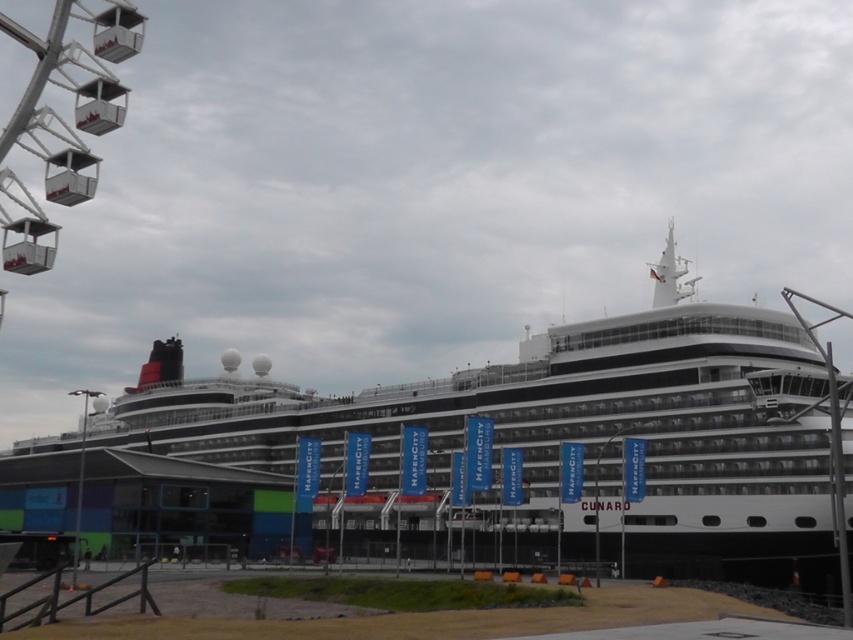
You are standing on the dock and looking at the scene. Which object is positioned to the right of the other between the white glossy cruise ship at center and the metallic silver ferris wheel at upper left?

The white glossy cruise ship at center is positioned to the right of the metallic silver ferris wheel at upper left.

You are standing on the dock at the HAFENCITY HAMBURG port, looking towards the cruise ship. According to the image, where is the white glossy cruise ship at center positioned relative to your viewpoint?

The white glossy cruise ship at center is positioned at coordinates approximately 0.695 on the x axis and 0.638 on the y axis relative to your viewpoint.

You are standing on the dock at HAFENCITY HAMBURG and looking at the cruise ship. There are two points marked on the dock. One is at coordinate point (328, 500) and the other is at coordinate point (80, 180). Which point is closer to you?

Point (80, 180) is closer to you because it is less further to the camera than point (328, 500).